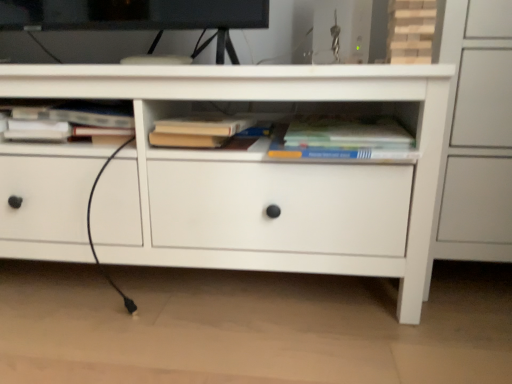
Question: Which direction should I rotate to look at hardcover book at center, which appears as the 2th book when viewed from the left, — up or down?

Choices:
 (A) down
 (B) up

Answer: (B)

Question: Considering the relative sizes of white matte chest of drawers at center and hardcover book at center, the second book viewed from the right, in the image provided, is white matte chest of drawers at center shorter than hardcover book at center, the second book viewed from the right,?

Choices:
 (A) no
 (B) yes

Answer: (A)

Question: Is white matte chest of drawers at center in front of hardcover book at center, the second book viewed from the right?

Choices:
 (A) yes
 (B) no

Answer: (A)

Question: Is white matte chest of drawers at center further to the viewer compared to hardcover book at center, the second book viewed from the right?

Choices:
 (A) yes
 (B) no

Answer: (B)

Question: Is white matte chest of drawers at center oriented towards hardcover book at center, the second book viewed from the right?

Choices:
 (A) no
 (B) yes

Answer: (B)

Question: Is white matte chest of drawers at center at the left side of hardcover book at center, the second book viewed from the right?

Choices:
 (A) no
 (B) yes

Answer: (B)

Question: Is white matte chest of drawers at center with hardcover book at center, the second book viewed from the right?

Choices:
 (A) no
 (B) yes

Answer: (A)

Question: Does hardcover book at center, arranged as the third book when viewed from the left, turn towards white matte chest of drawers at center?

Choices:
 (A) no
 (B) yes

Answer: (B)

Question: Considering the relative sizes of hardcover book at center, arranged as the third book when viewed from the left, and white matte chest of drawers at center in the image provided, is hardcover book at center, arranged as the third book when viewed from the left, smaller than white matte chest of drawers at center?

Choices:
 (A) no
 (B) yes

Answer: (B)

Question: Is hardcover book at center, arranged as the third book when viewed from the left, at the left side of white matte chest of drawers at center?

Choices:
 (A) yes
 (B) no

Answer: (B)

Question: Considering the relative sizes of hardcover book at center, the 1th book in the right-to-left sequence, and white matte chest of drawers at center in the image provided, is hardcover book at center, the 1th book in the right-to-left sequence, thinner than white matte chest of drawers at center?

Choices:
 (A) no
 (B) yes

Answer: (B)

Question: Is hardcover book at center, arranged as the third book when viewed from the left, oriented away from white matte chest of drawers at center?

Choices:
 (A) yes
 (B) no

Answer: (A)

Question: Are hardcover book at center, the 1th book in the right-to-left sequence, and white matte chest of drawers at center located far from each other?

Choices:
 (A) no
 (B) yes

Answer: (A)

Question: Is hardcover book at center, which appears as the 2th book when viewed from the left, taller than white matte chest of drawers at center?

Choices:
 (A) yes
 (B) no

Answer: (B)